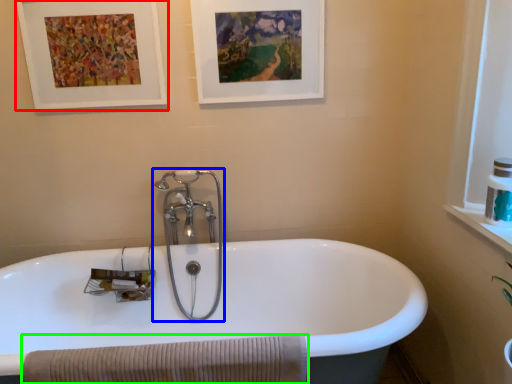
Question: Estimate the real-world distances between objects in this image. Which object is farther from picture frame (highlighted by a red box), tap (highlighted by a blue box) or bath towel (highlighted by a green box)?

Choices:
 (A) tap
 (B) bath towel

Answer: (B)